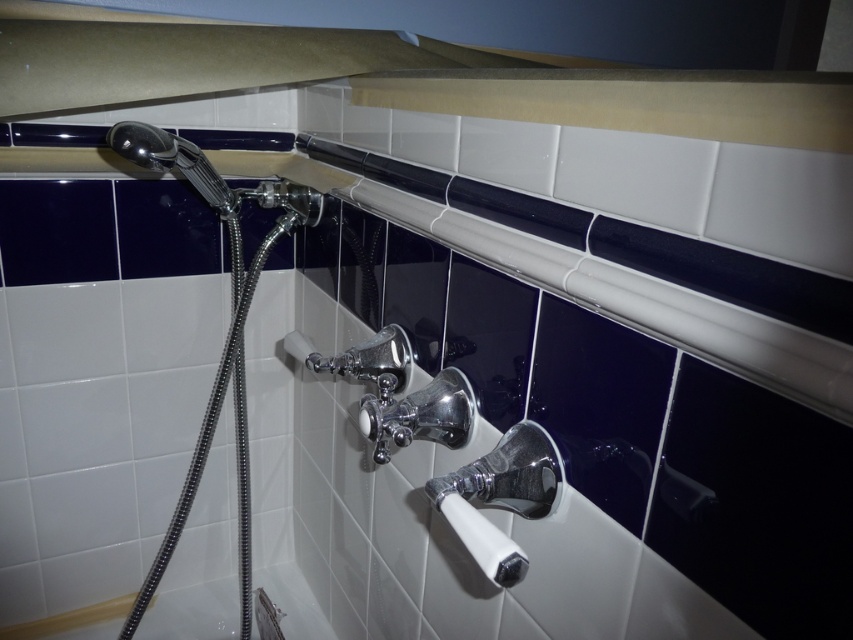
You are standing in the bathroom and want to locate the white glossy bath at lower left. According to the coordinates provided, where exactly should you look?

You should look at point (193, 612) to find the white glossy bath at lower left.

You are standing in the bathroom and want to adjust the water temperature using the faucet. Which object should you approach first, the white glossy bath at lower left or the shiny chrome shower head at upper left?

You should approach the white glossy bath at lower left first because it is closer to you than the shiny chrome shower head at upper left.

You are standing in a bathroom and want to place a small plant between the white glossy bath at lower left and the shiny chrome shower head at upper left. Based on their positions, which object should the plant be closer to?

The white glossy bath at lower left is positioned on the left side of the shiny chrome shower head at upper left, so placing the plant closer to the bath would mean it is between them. However, since the bath is on the left of the shower head, the plant should be placed closer to the white glossy bath at lower left to be between them.